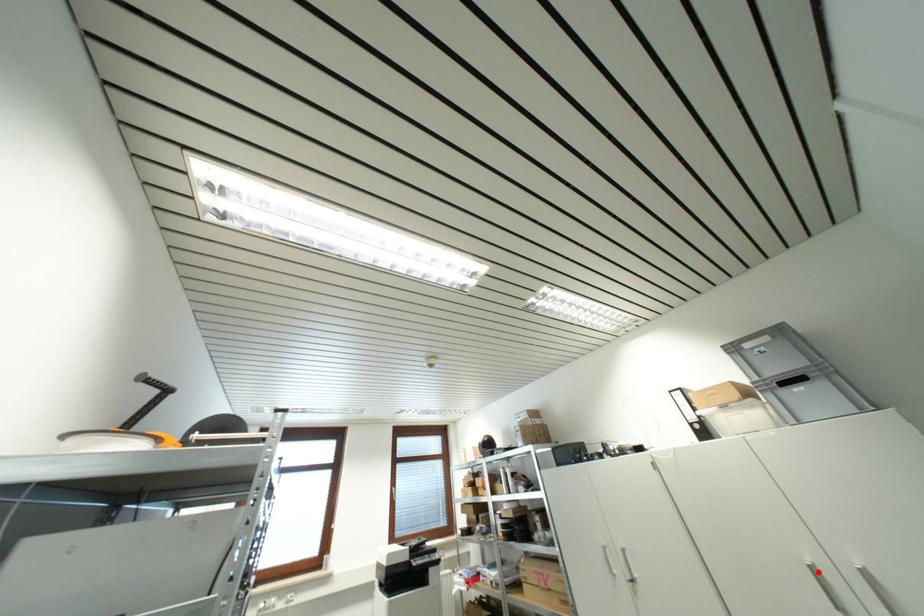
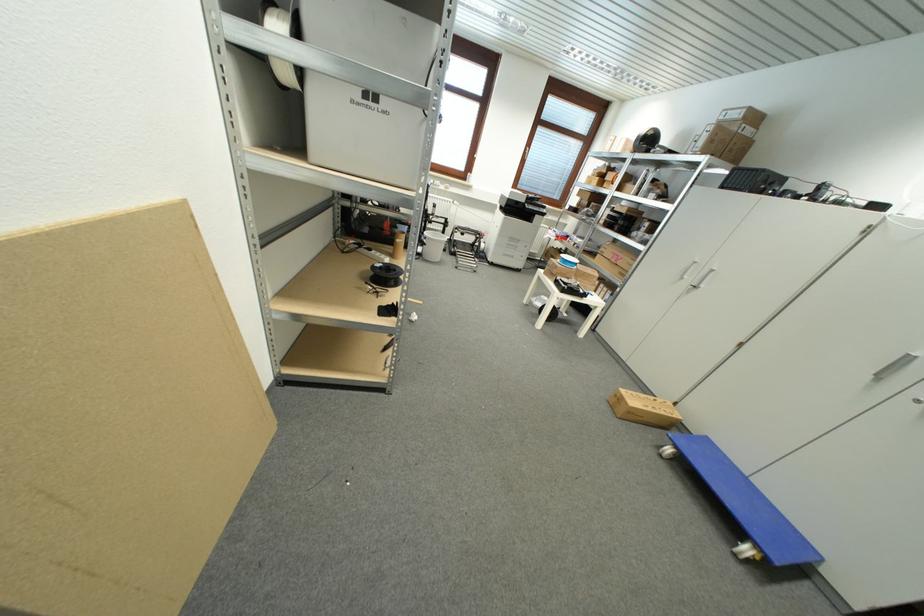
The point at the highlighted location is marked in the first image. Where is the corresponding point in the second image?

(913, 361)